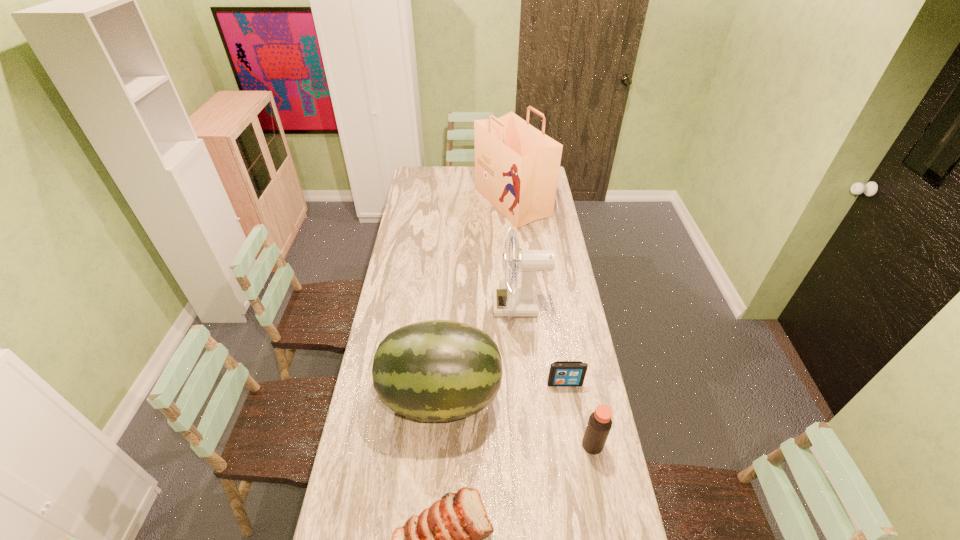
Where is `vacant space located on the front-facing side of the fan`? Image resolution: width=960 pixels, height=540 pixels. vacant space located on the front-facing side of the fan is located at coordinates (447, 305).

This screenshot has height=540, width=960. Find the location of `vacant space situated on the front-facing side of the fan`. vacant space situated on the front-facing side of the fan is located at coordinates (407, 305).

Image resolution: width=960 pixels, height=540 pixels. Find the location of `vacant space located on the front-facing side of the fan`. vacant space located on the front-facing side of the fan is located at coordinates (482, 305).

What are the coordinates of `vacant area situated on the back of the third tallest object` in the screenshot? It's located at click(448, 296).

You are a GUI agent. You are given a task and a screenshot of the screen. Output one action in this format:
    pyautogui.click(x=<x>, y=<y>)
    Task: Click on the free spot located 0.220m on the left of the fourth tallest object
    The image size is (960, 540).
    Given the screenshot: What is the action you would take?
    click(x=516, y=445)

I want to click on free region located 0.280m on the front screen of the second shortest object, so click(x=578, y=462).

What are the coordinates of `object that is at the far edge` in the screenshot? It's located at (517, 166).

Find the location of a particular element. object that is at the left edge is located at coordinates (438, 370).

Find the location of a particular element. This screenshot has width=960, height=540. grocery bag at the right edge is located at coordinates (517, 166).

The height and width of the screenshot is (540, 960). I want to click on fan that is at the right edge, so click(513, 301).